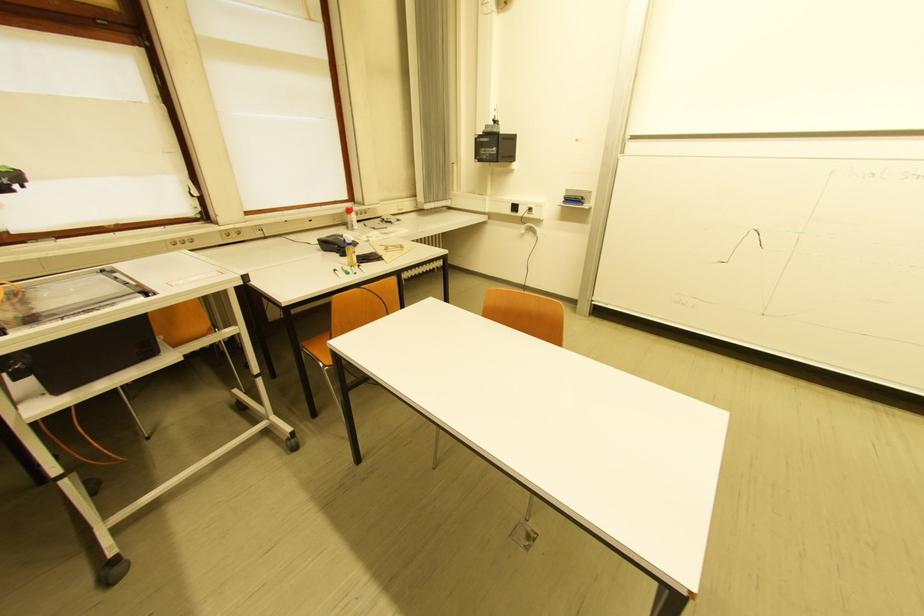
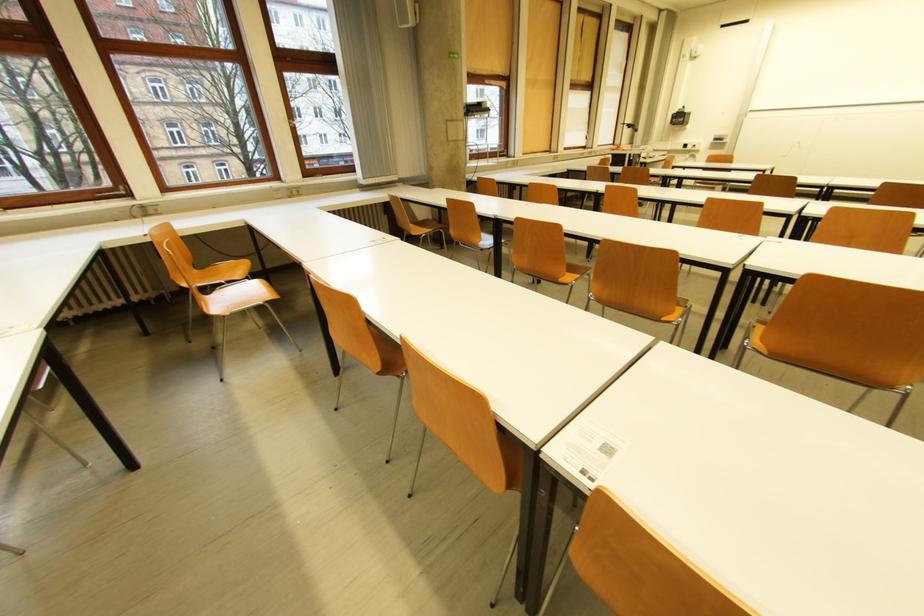
Where in the second image is the point corresponding to pixel 521 209 from the first image?

(691, 147)